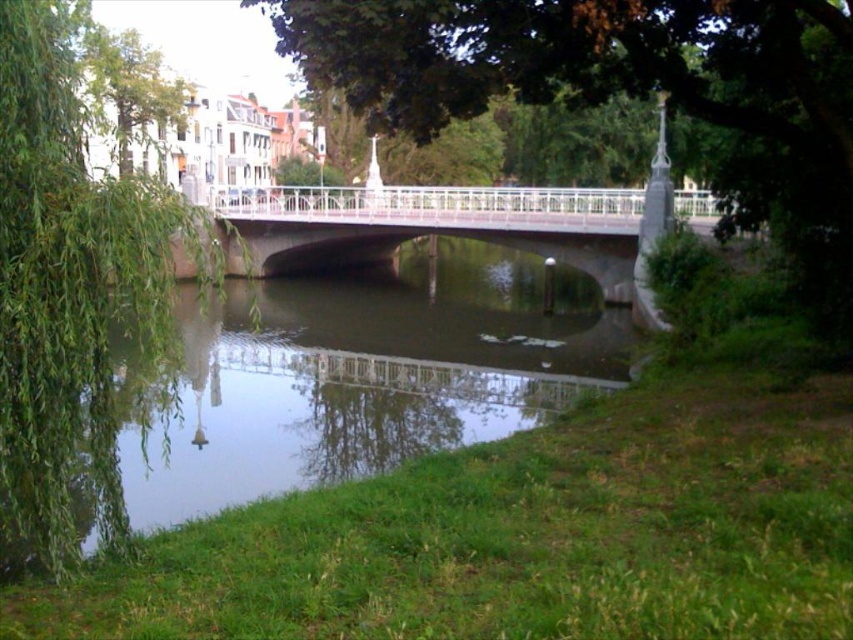
You are a painter setting up your easel to capture the riverside scene. You want to ensure the green leafy willow at left and the white metallic bridge at center are both visible in your painting. Based on their widths, which object should you position closer to the edge of your canvas to maintain their natural proportions?

The green leafy willow at left has a lesser width compared to the white metallic bridge at center, so you should position the green leafy willow at left closer to the edge of your canvas to maintain their natural proportions.

You are a hiker who wants to cross the river using the bridge. You notice the green grassy river at center and the green leafy willow at left. Which object is closer to the bridge?

The green grassy river at center is located below the green leafy willow at left, so the green grassy river at center is closer to the bridge than the green leafy willow at left.